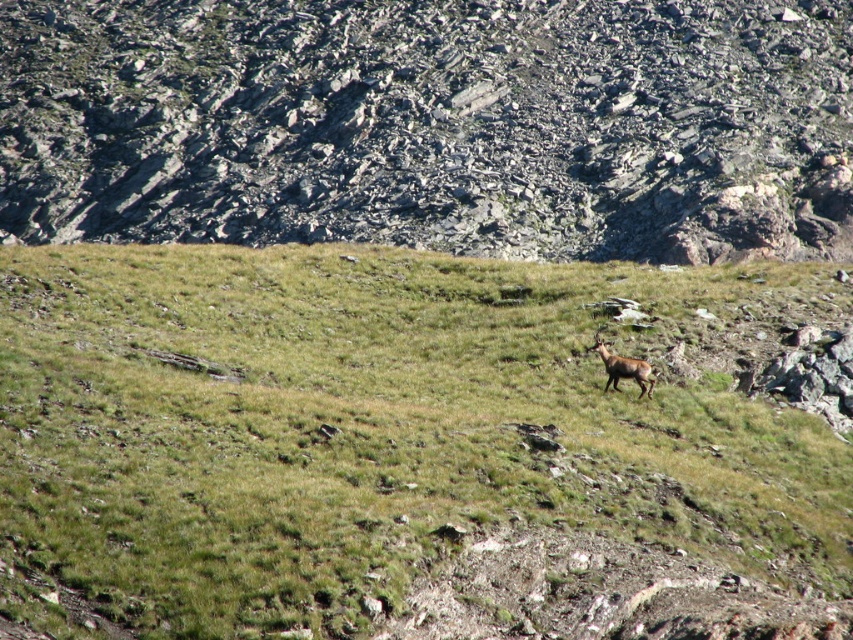
Question: Is green grassy at center closer to camera compared to gray rock at upper center?

Choices:
 (A) yes
 (B) no

Answer: (A)

Question: Estimate the real-world distances between objects in this image. Which object is closer to the brown furry deer at center-right?

Choices:
 (A) green grassy at center
 (B) gray rock at upper center

Answer: (A)

Question: Where is green grassy at center located in relation to gray rock at upper center in the image?

Choices:
 (A) below
 (B) above

Answer: (A)

Question: Which point is farther to the camera?

Choices:
 (A) (498, 300)
 (B) (650, 380)
 (C) (281, 198)

Answer: (C)

Question: Which is nearer to the green grassy at center?

Choices:
 (A) brown furry deer at center-right
 (B) gray rock at upper center

Answer: (A)

Question: Is the position of green grassy at center less distant than that of brown furry deer at center-right?

Choices:
 (A) yes
 (B) no

Answer: (A)